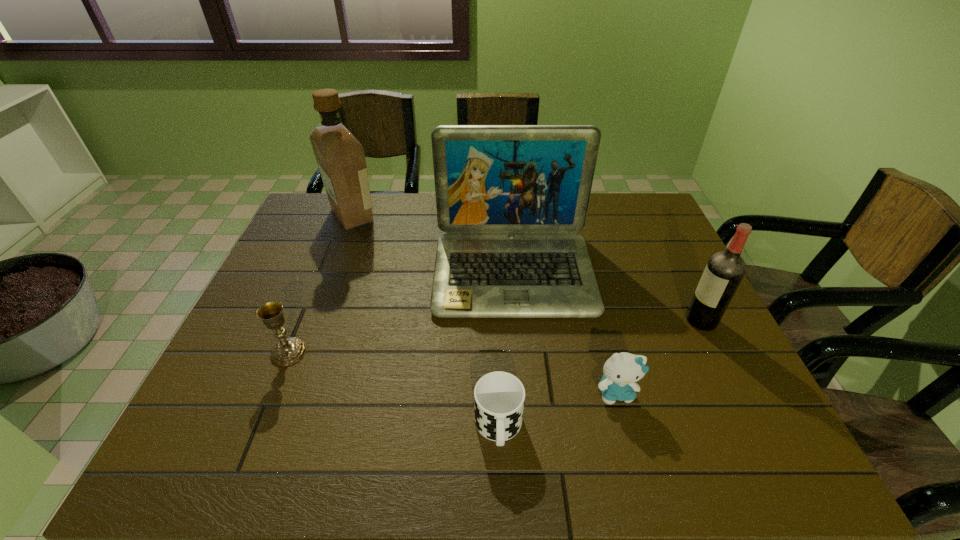
This screenshot has height=540, width=960. In order to click on free space located 0.130m on the screen of the laptop computer in this screenshot , I will do `click(521, 362)`.

Locate an element on the screen. free space located 0.390m on the front-facing side of the rightmost object is located at coordinates (533, 320).

You are a GUI agent. You are given a task and a screenshot of the screen. Output one action in this format:
    pyautogui.click(x=<x>, y=<y>)
    Task: Click on the free region located on the front-facing side of the rightmost object
    
    Given the screenshot: What is the action you would take?
    pyautogui.click(x=584, y=320)

I want to click on vacant region located on the front-facing side of the rightmost object, so click(x=635, y=320).

What are the coordinates of `vacant space situated on the right of the chalice` in the screenshot? It's located at click(445, 352).

Locate an element on the screen. The height and width of the screenshot is (540, 960). vacant space positioned on the face of the kitten is located at coordinates (634, 458).

Where is `object present at the far edge`? object present at the far edge is located at coordinates (340, 157).

This screenshot has height=540, width=960. What are the coordinates of `object that is positioned at the near edge` in the screenshot? It's located at (499, 397).

In order to click on liquor positioned at the left edge in this screenshot , I will do `click(340, 157)`.

Where is `chalice that is at the left edge`? The width and height of the screenshot is (960, 540). chalice that is at the left edge is located at coordinates (288, 351).